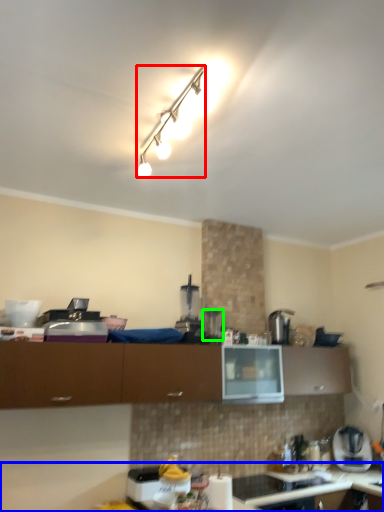
Question: Which object is positioned farthest from lamp (highlighted by a red box)? Select from countertop (highlighted by a blue box) and appliance (highlighted by a green box).

Choices:
 (A) countertop
 (B) appliance

Answer: (A)